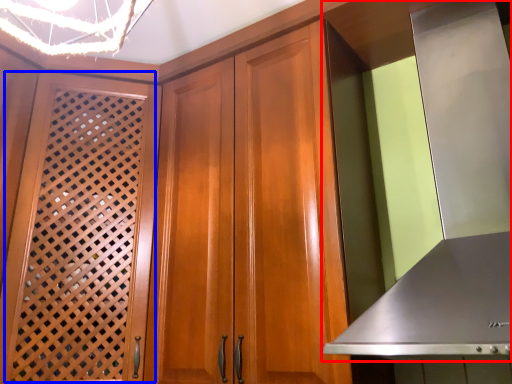
Question: Which object is closer to the camera taking this photo, exhaust hood (highlighted by a red box) or screen door (highlighted by a blue box)?

Choices:
 (A) exhaust hood
 (B) screen door

Answer: (A)